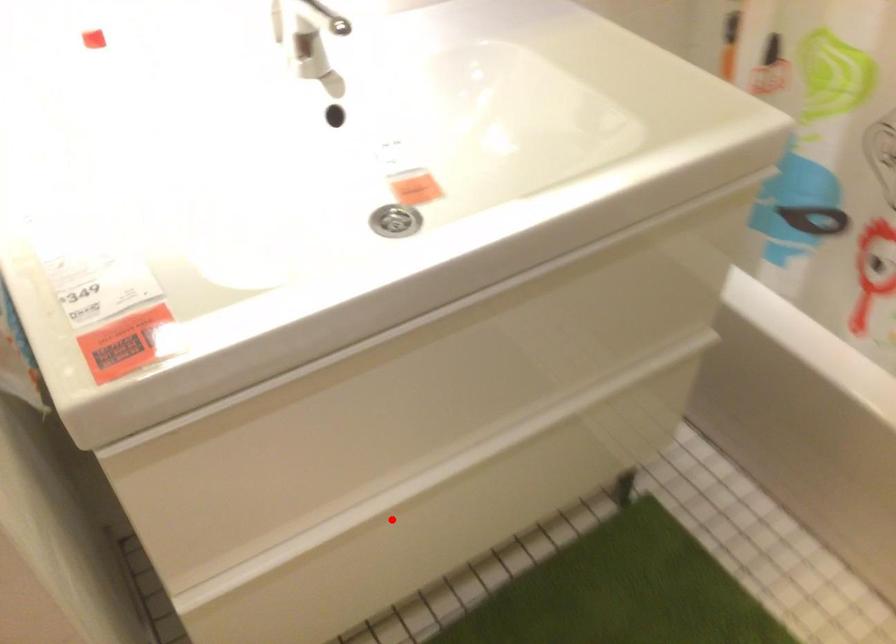
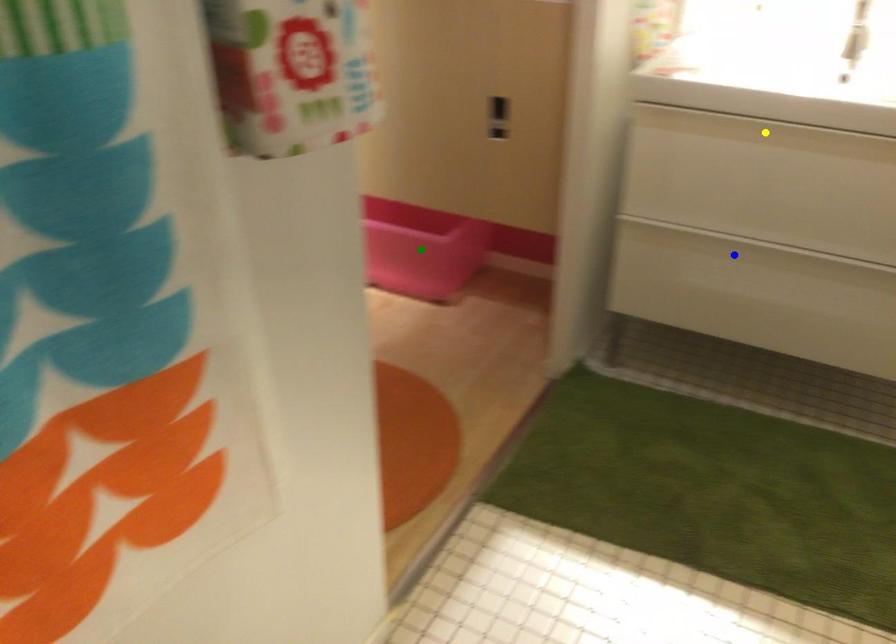
Question: I am providing you with two images of the same scene from different viewpoints. A red point is marked on the first image. You are given multiple points on the second image. In image 2, which mark is for the same physical point as the one in image 1?

Choices:
 (A) blue point
 (B) yellow point
 (C) green point

Answer: (A)